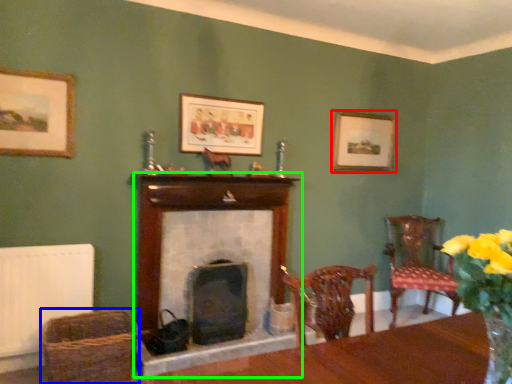
Question: Considering the real-world distances, which object is farthest from picture frame (highlighted by a red box)? basket (highlighted by a blue box) or fireplace (highlighted by a green box)?

Choices:
 (A) basket
 (B) fireplace

Answer: (A)